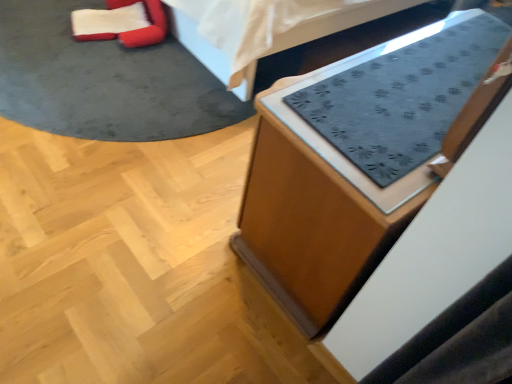
Question: From a real-world perspective, does velvet red bean bag chair at upper left sit lower than dark gray fabric mat at upper center, the first furniture positioned from the top?

Choices:
 (A) no
 (B) yes

Answer: (B)

Question: From the image's perspective, is velvet red bean bag chair at upper left below dark gray fabric mat at upper center, the first furniture positioned from the top?

Choices:
 (A) no
 (B) yes

Answer: (B)

Question: Is velvet red bean bag chair at upper left facing towards dark gray fabric mat at upper center, which appears as the second furniture when ordered from the bottom?

Choices:
 (A) no
 (B) yes

Answer: (A)

Question: From the image's perspective, is velvet red bean bag chair at upper left above dark gray fabric mat at upper center, which appears as the second furniture when ordered from the bottom?

Choices:
 (A) no
 (B) yes

Answer: (A)

Question: Can you confirm if velvet red bean bag chair at upper left is positioned to the right of dark gray fabric mat at upper center, the first furniture positioned from the top?

Choices:
 (A) no
 (B) yes

Answer: (A)

Question: In the image, is dark gray fabric mat at upper center, the first furniture positioned from the top, positioned in front of or behind wooden cabinet at lower right, which is the second furniture from top to bottom?

Choices:
 (A) front
 (B) behind

Answer: (B)

Question: From a real-world perspective, is dark gray fabric mat at upper center, the first furniture positioned from the top, positioned above or below wooden cabinet at lower right, which ranks as the 1th furniture in bottom-to-top order?

Choices:
 (A) above
 (B) below

Answer: (B)

Question: Is point (335, 38) positioned closer to the camera than point (245, 221)?

Choices:
 (A) closer
 (B) farther

Answer: (B)

Question: In the image, is dark gray fabric mat at upper center, the first furniture positioned from the top, on the left side or the right side of wooden cabinet at lower right, which ranks as the 1th furniture in bottom-to-top order?

Choices:
 (A) right
 (B) left

Answer: (B)

Question: Is wooden cabinet at lower right, which ranks as the 1th furniture in bottom-to-top order, inside the boundaries of velvet red bean bag chair at upper left, or outside?

Choices:
 (A) outside
 (B) inside

Answer: (A)

Question: Is wooden cabinet at lower right, which is the second furniture from top to bottom, to the left or to the right of velvet red bean bag chair at upper left in the image?

Choices:
 (A) left
 (B) right

Answer: (B)

Question: From the image's perspective, relative to velvet red bean bag chair at upper left, is wooden cabinet at lower right, which ranks as the 1th furniture in bottom-to-top order, above or below?

Choices:
 (A) above
 (B) below

Answer: (B)

Question: Considering the positions of point (304, 321) and point (128, 3), is point (304, 321) closer or farther from the camera than point (128, 3)?

Choices:
 (A) closer
 (B) farther

Answer: (A)

Question: Choose the correct answer: Is velvet red bean bag chair at upper left inside wooden cabinet at lower right, which ranks as the 1th furniture in bottom-to-top order, or outside it?

Choices:
 (A) outside
 (B) inside

Answer: (A)

Question: From a real-world perspective, relative to wooden cabinet at lower right, which ranks as the 1th furniture in bottom-to-top order, is velvet red bean bag chair at upper left vertically above or below?

Choices:
 (A) below
 (B) above

Answer: (A)